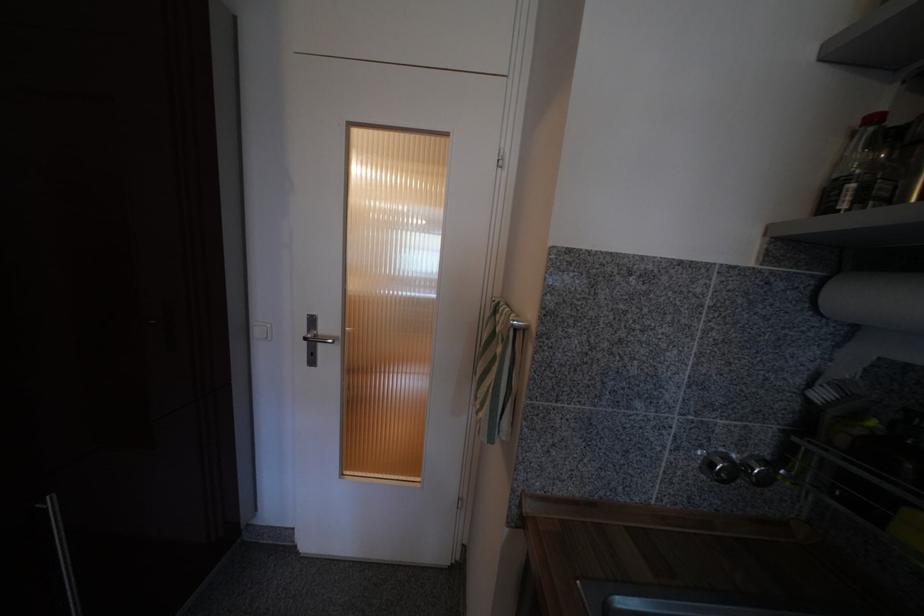
Where would you pull the silver door handle? Please return your answer as a coordinate pair (x, y).

(313, 339)